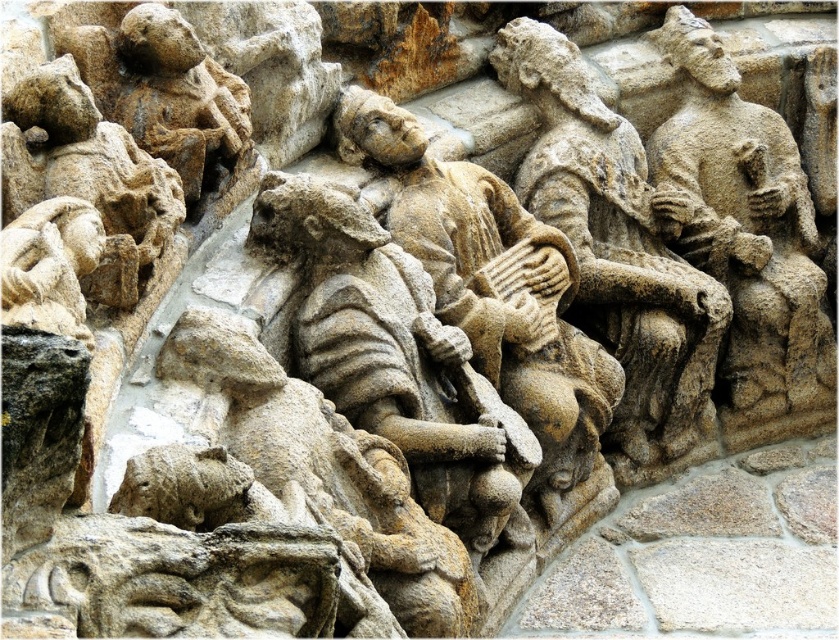
Does stone figure at center have a smaller size compared to sandstone figure at right?

Correct, stone figure at center occupies less space than sandstone figure at right.

You are a GUI agent. You are given a task and a screenshot of the screen. Output one action in this format:
    pyautogui.click(x=<x>, y=<y>)
    Task: Click on the stone figure at center
    Image resolution: width=839 pixels, height=640 pixels.
    Given the screenshot: What is the action you would take?
    pyautogui.click(x=393, y=353)

At what (x,y) coordinates should I click in order to perform the action: click on stone figure at center. Please return your answer as a coordinate pair (x, y). This screenshot has height=640, width=839. Looking at the image, I should click on (393, 353).